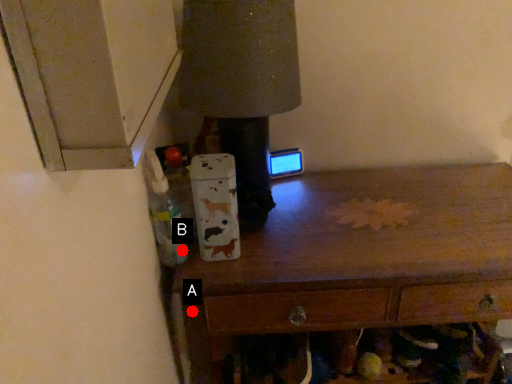
Question: Two points are circled on the image, labeled by A and B beside each circle. Which point appears closest to the camera in this image?

Choices:
 (A) A is closer
 (B) B is closer

Answer: (B)